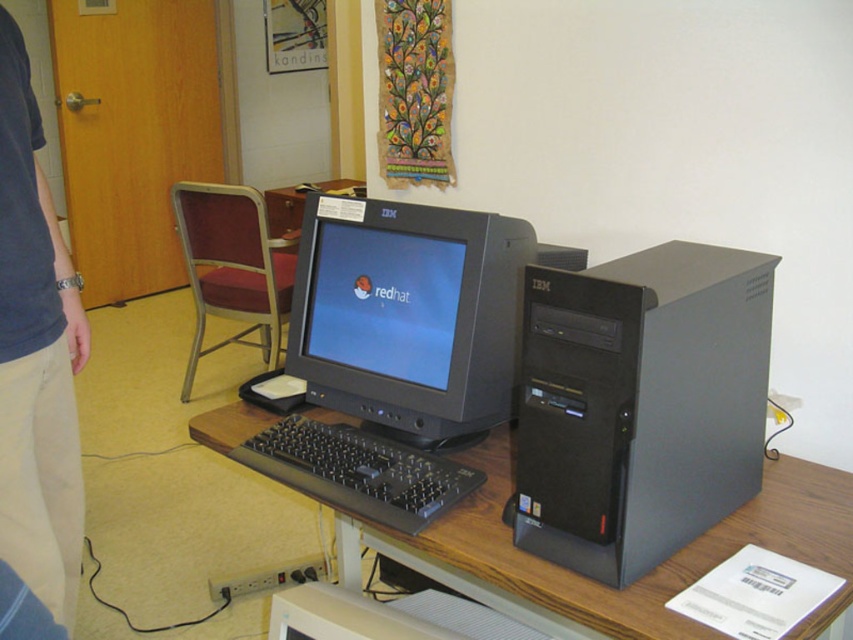
Between blue denim shirt at left and black plastic keyboard at center, which one has less height?

black plastic keyboard at center is shorter.

Who is more distant from viewer, (7, 172) or (341, 444)?

The point (341, 444) is more distant.

Which is in front, point (35, 410) or point (383, 515)?

Positioned in front is point (383, 515).

Identify the location of blue denim shirt at left. (36, 355).

Who is taller, matte black monitor at center or brown wood computer desk at center?

Standing taller between the two is matte black monitor at center.

You are a GUI agent. You are given a task and a screenshot of the screen. Output one action in this format:
    pyautogui.click(x=<x>, y=<y>)
    Task: Click on the matte black monitor at center
    
    Given the screenshot: What is the action you would take?
    pyautogui.click(x=408, y=314)

Between matte black monitor at center and black plastic keyboard at center, which one is positioned lower?

black plastic keyboard at center

Is matte black monitor at center thinner than black plastic keyboard at center?

In fact, matte black monitor at center might be wider than black plastic keyboard at center.

Find the location of a particular element. The image size is (853, 640). matte black monitor at center is located at coordinates (408, 314).